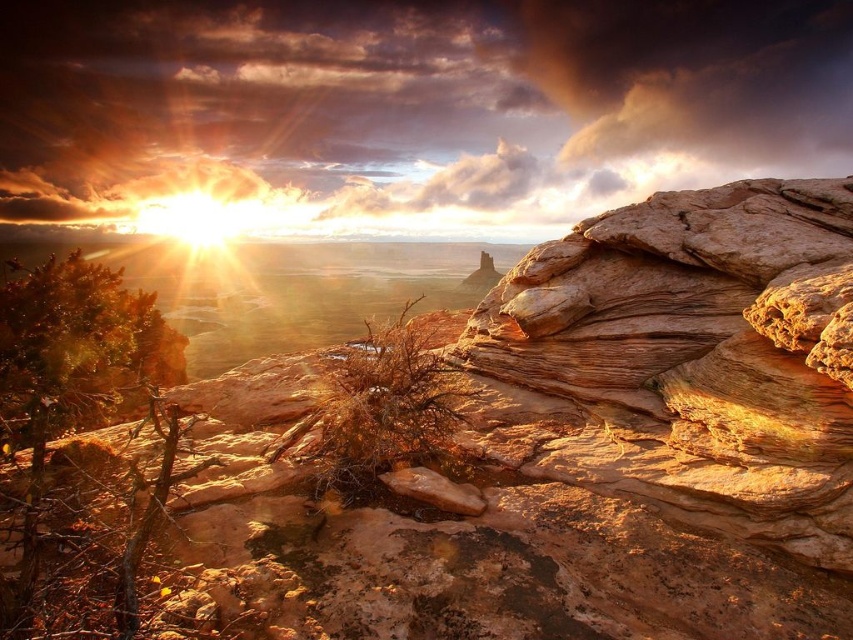
Which is behind, point (662, 220) or point (660, 100)?

Positioned behind is point (660, 100).

Can you confirm if rustic sandstone rock at center is positioned to the left of cloudy textured sky at upper center?

Correct, you'll find rustic sandstone rock at center to the left of cloudy textured sky at upper center.

Find the location of a particular element. rustic sandstone rock at center is located at coordinates (595, 436).